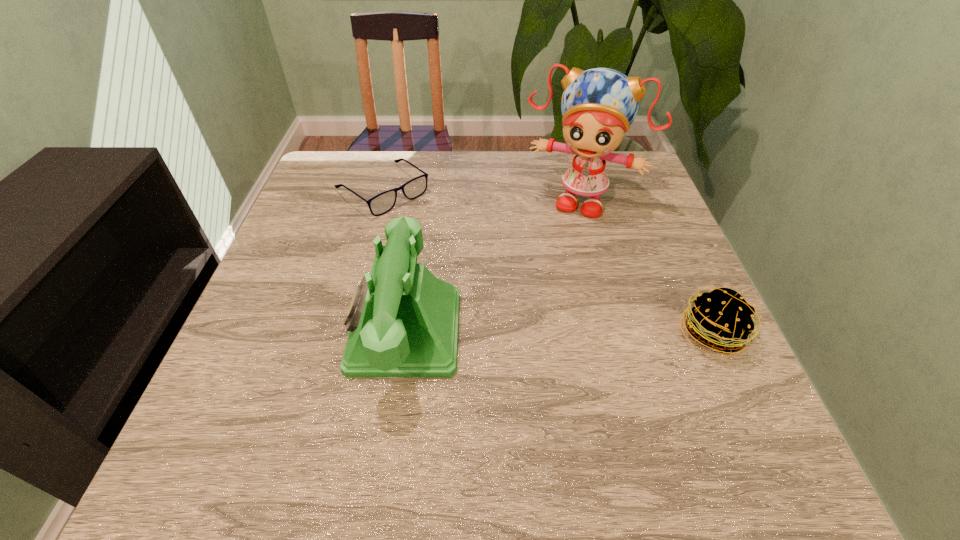
Find the location of a particular element. This screenshot has height=540, width=960. vacant space on the desktop that is between the second tallest object and the third tallest object and is positioned on the face of the doll is located at coordinates (527, 332).

Locate an element on the screen. The height and width of the screenshot is (540, 960). free space on the desktop that is between the telephone and the patty and is positioned on the front-facing side of the shortest object is located at coordinates (567, 333).